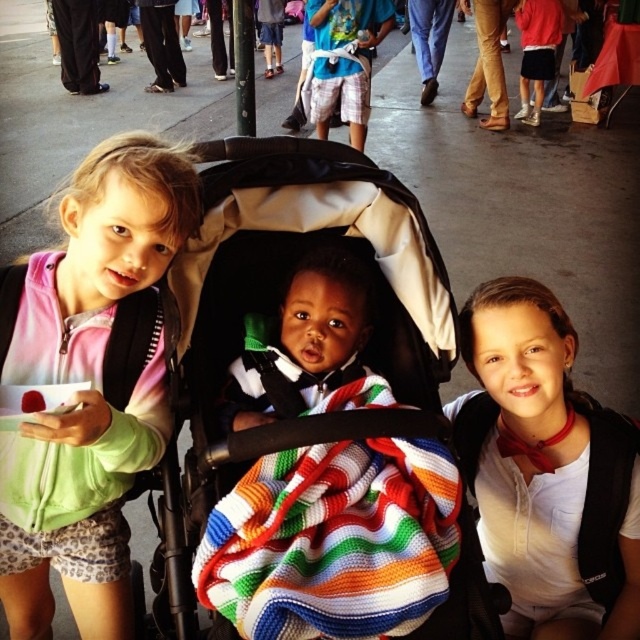
Is black fabric baby carriage at center smaller than white matte shirt at center?

No.

Is black fabric baby carriage at center further to the viewer compared to white matte shirt at center?

No, it is not.

Is point (340, 374) closer to viewer compared to point (492, 429)?

Yes.

The width and height of the screenshot is (640, 640). What are the coordinates of `black fabric baby carriage at center` in the screenshot? It's located at (276, 317).

Is pink tie-dye hoodie at left shorter than blue t-shirt at center?

Yes, pink tie-dye hoodie at left is shorter than blue t-shirt at center.

Is pink tie-dye hoodie at left thinner than blue t-shirt at center?

Yes, pink tie-dye hoodie at left is thinner than blue t-shirt at center.

Where is `pink tie-dye hoodie at left`? pink tie-dye hoodie at left is located at coordinates click(x=93, y=372).

Looking at this image, which is more to the right, black fabric baby carriage at center or multicolored knitted blanket at center?

Positioned to the right is multicolored knitted blanket at center.

Is point (349, 166) in front of point (241, 488)?

No, it is not.

At what (x,y) coordinates should I click in order to perform the action: click on black fabric baby carriage at center. Please return your answer as a coordinate pair (x, y). The width and height of the screenshot is (640, 640). Looking at the image, I should click on (276, 317).